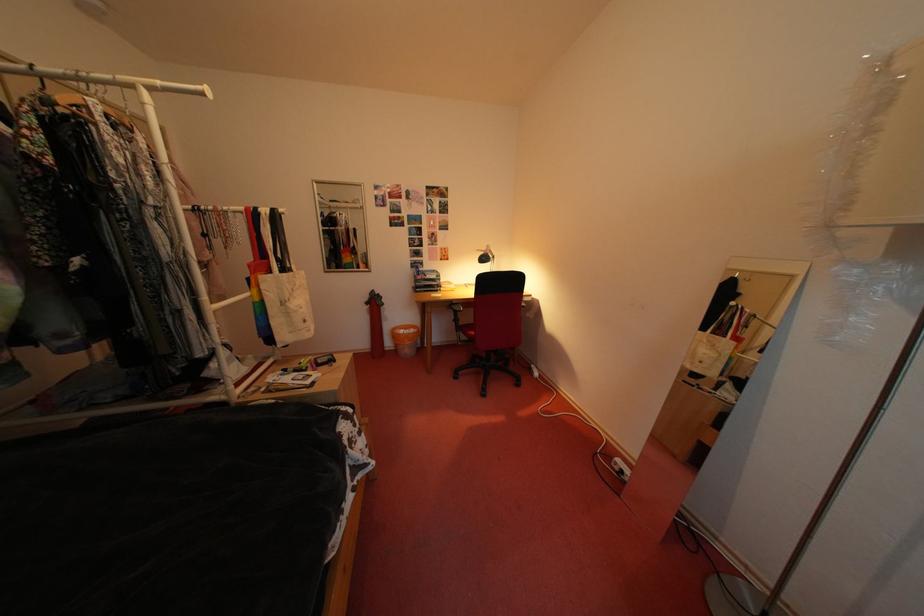
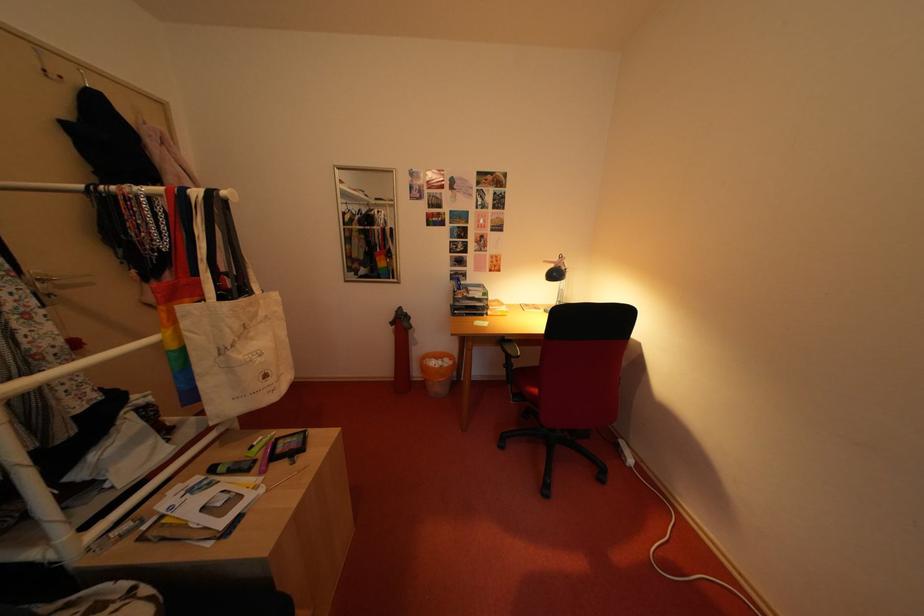
Question: The images are taken continuously from a first-person perspective. In which direction are you moving?

Choices:
 (A) Left
 (B) Right
 (C) Forward
 (D) Backward

Answer: (C)